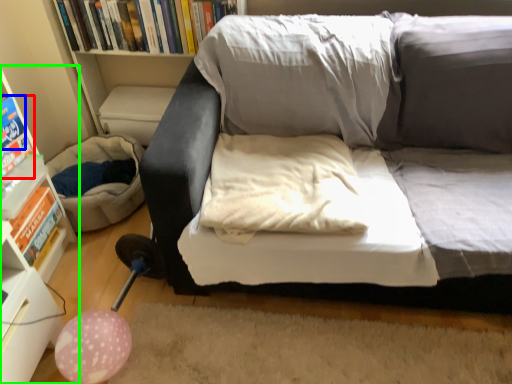
Question: Which is farther away from paperback book (highlighted by a red box)? paperback book (highlighted by a blue box) or shelf (highlighted by a green box)?

Choices:
 (A) paperback book
 (B) shelf

Answer: (B)